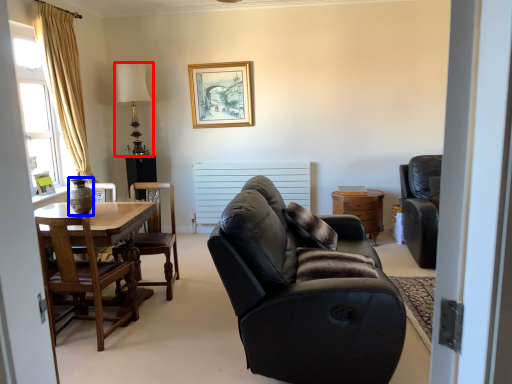
Question: Which object appears closest to the camera in this image, lamp (highlighted by a red box) or vase (highlighted by a blue box)?

Choices:
 (A) lamp
 (B) vase

Answer: (B)